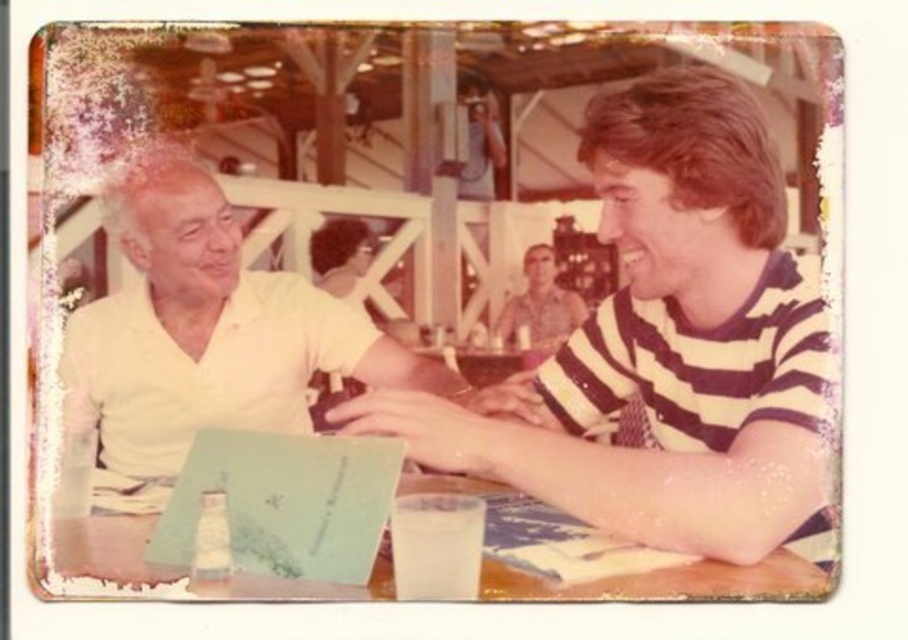
Between white matte shirt at left and striped cotton shirt at center, which one appears on the left side from the viewer's perspective?

From the viewer's perspective, white matte shirt at left appears more on the left side.

Does point (140, 422) come closer to viewer compared to point (541, 305)?

That is True.

Locate an element on the screen. The width and height of the screenshot is (908, 640). white matte shirt at left is located at coordinates (200, 342).

Which is more to the right, wooden table at lower left or striped cotton shirt at center?

striped cotton shirt at center is more to the right.

Is wooden table at lower left to the left of striped cotton shirt at center from the viewer's perspective?

Yes, wooden table at lower left is to the left of striped cotton shirt at center.

Does point (125, 547) lie behind point (515, 300)?

No, (125, 547) is in front of (515, 300).

At what (x,y) coordinates should I click in order to perform the action: click on wooden table at lower left. Please return your answer as a coordinate pair (x, y). The width and height of the screenshot is (908, 640). Looking at the image, I should click on (601, 556).

Who is taller, white matte shirt at upper left or striped cotton shirt at center?

Standing taller between the two is white matte shirt at upper left.

Can you confirm if white matte shirt at upper left is positioned to the right of striped cotton shirt at center?

No, white matte shirt at upper left is not to the right of striped cotton shirt at center.

Find the location of a particular element. white matte shirt at upper left is located at coordinates (666, 346).